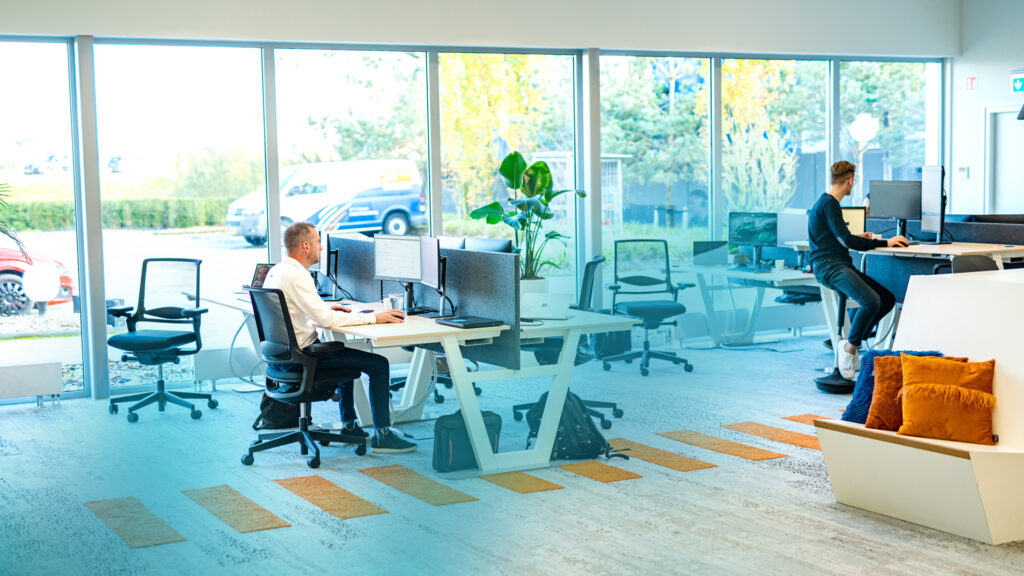
What are the coordinates of `amount of orange rectangles there are on the floor` in the screenshot? It's located at (809, 414), (790, 437), (750, 450), (669, 452), (607, 478), (534, 483), (433, 487), (335, 507), (253, 513), (131, 522).